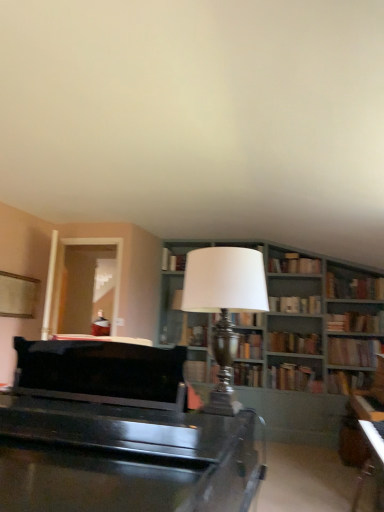
Question: Considering the positions of hardcover book at upper right, which appears as the first book when viewed from the top, and hardcover book at center, which is the 10th book from bottom to top, in the image, is hardcover book at upper right, which appears as the first book when viewed from the top, wider or thinner than hardcover book at center, which is the 10th book from bottom to top,?

Choices:
 (A) thin
 (B) wide

Answer: (B)

Question: Is hardcover book at upper right, the 13th book when ordered from bottom to top, taller or shorter than hardcover book at center, which is the 10th book from bottom to top?

Choices:
 (A) tall
 (B) short

Answer: (A)

Question: Estimate the real-world distances between objects in this image. Which object is farther from the hardcover book at center, the eighth book in the top-to-bottom sequence?

Choices:
 (A) silver metallic table lamp at center
 (B) matte brown book at center, acting as the 6th book starting from the top
 (C) hardcover book at upper right, the third book when ordered from top to bottom
 (D) hardcover book at center, positioned as the 9th book in top-to-bottom order
 (E) hardcover book at right, which ranks as the 13th book in top-to-bottom order

Answer: (A)

Question: Which object is positioned farthest from the hardcover book at center, the eighth book in the top-to-bottom sequence?

Choices:
 (A) clear glass door at left
 (B) hardcover book at center, which is the 10th book from bottom to top
 (C) hardcover book at center, positioned as the 9th book in top-to-bottom order
 (D) matte brown book at center, acting as the eighth book starting from the bottom
 (E) wooden bookshelf at center

Answer: (A)